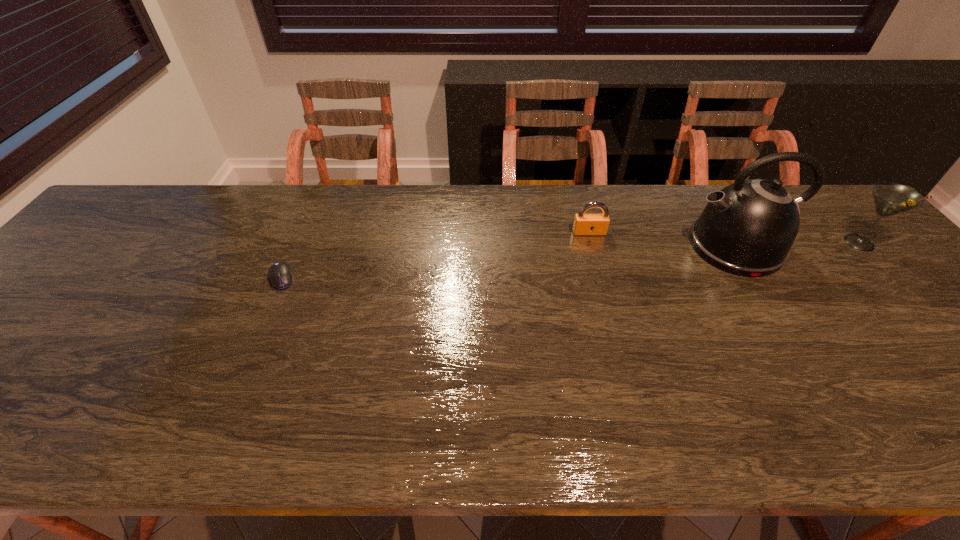
Find the location of a particular element. This screenshot has height=540, width=960. vacant area that lies between the tallest object and the shortest object is located at coordinates (509, 262).

This screenshot has height=540, width=960. What are the coordinates of `object that is the third closest to the rightmost object` in the screenshot? It's located at (280, 275).

In order to click on object that ranks as the third closest to the kettle in this screenshot , I will do `click(280, 275)`.

You are a GUI agent. You are given a task and a screenshot of the screen. Output one action in this format:
    pyautogui.click(x=<x>, y=<y>)
    Task: Click on the free space that satisfies the following two spatial constraints: 1. to unlock the third object from right to left from the front; 2. on the left side of the martini
    
    Given the screenshot: What is the action you would take?
    pyautogui.click(x=592, y=242)

You are a GUI agent. You are given a task and a screenshot of the screen. Output one action in this format:
    pyautogui.click(x=<x>, y=<y>)
    Task: Click on the vacant area that satisfies the following two spatial constraints: 1. to unlock the padlock from the front; 2. on the right side of the rightmost object
    The width and height of the screenshot is (960, 540).
    Given the screenshot: What is the action you would take?
    pyautogui.click(x=592, y=242)